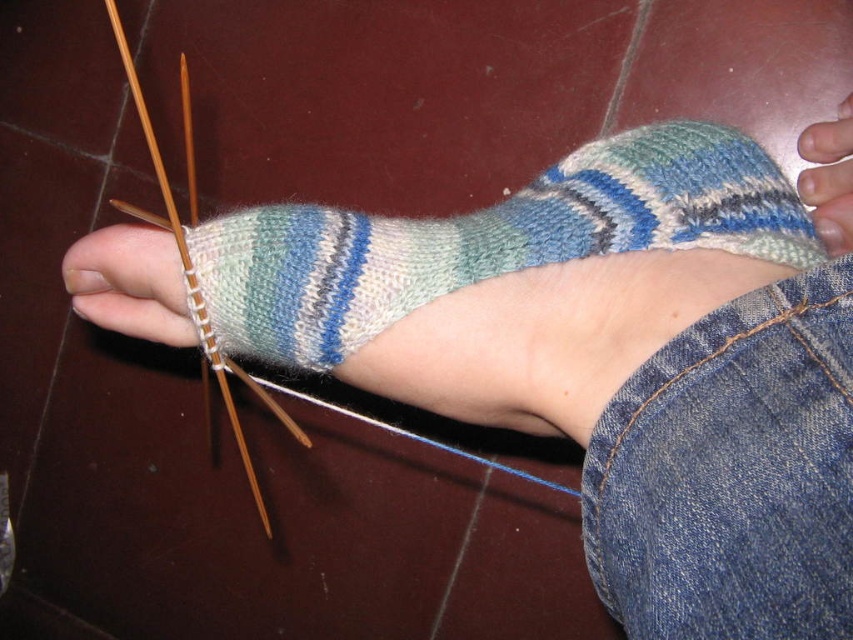
You are a tailor trying to determine if the knitted woolen sock at center will fit over the smooth skin at center. Based on the sock and skin dimensions, will the sock fit properly?

The knitted woolen sock at center has a greater width than the smooth skin at center, so the sock should fit comfortably over the skin without being too tight.

Based on the photo, you are taking a photo of two points in the scene. The first point is at coordinates point (292,305) and the second point is at point (848,144). Which point will appear larger in your photo?

Point (292,305) is closer to the camera than point (848,144), so it will appear larger in the photo.

You are a tailor trying to finish a sock. You have the knitted woolen sock at center and the wooden knitting needle at lower left. Which object is smaller?

The knitted woolen sock at center is smaller than wooden knitting needle at lower left.